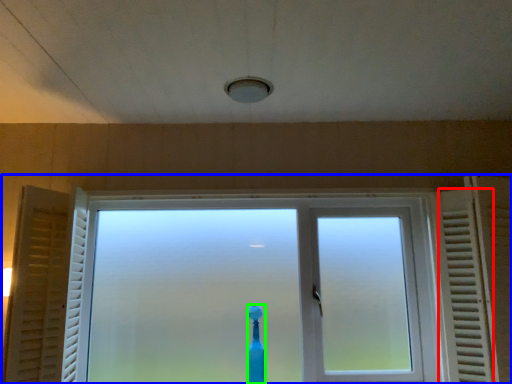
Question: Which object is the farthest from radiator (highlighted by a red box)? Choose among these: window (highlighted by a blue box) or toothbrush (highlighted by a green box).

Choices:
 (A) window
 (B) toothbrush

Answer: (B)